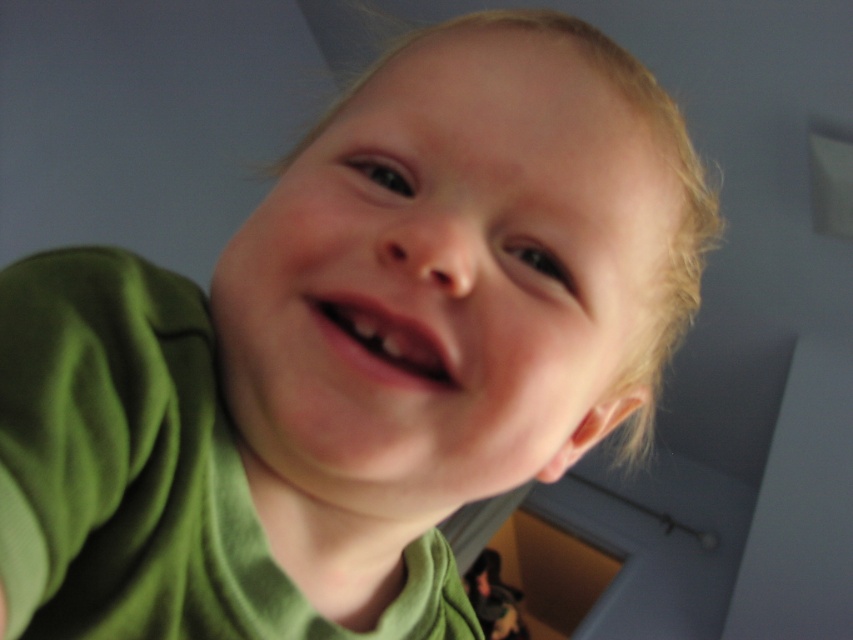
You are holding a 12 inch ruler and want to measure the distance from your eyes to the point at coordinates point (578, 445) in the image. Can you reach it with your ruler?

The point at coordinates point (578, 445) is 16.00 inches away from the viewer, so the 12 inch ruler is not long enough to reach it.

Consider the image. The child in the image has a smooth skin face at center and pink matte lips at center. Which of these two features is positioned more to the right?

The smooth skin face at center is positioned to the right of the pink matte lips at center.

You are taking a photo of a child and notice two points in the image. The first point is at coordinate point (392,228) and the second is at point (428,364). From the camera perspective, which point is closer to the front?

Point (392,228) is in front of point (428,364), so it is closer to the front.